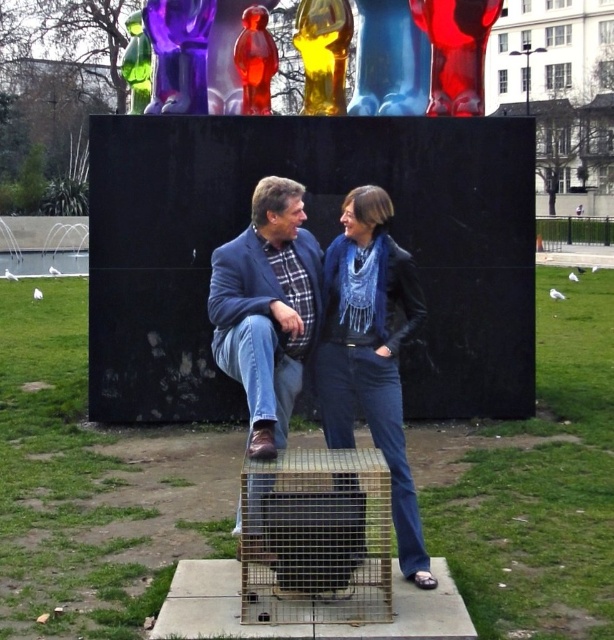
You are a photographer trying to capture a clear photo of the blue denim scarf at center without the matte blue jacket at center blocking it. Based on their positions in the scene, is this possible?

The matte blue jacket at center is behind the blue denim scarf at center, so it is possible to capture a clear photo of the blue denim scarf at center without the matte blue jacket at center blocking it by adjusting the angle to ensure the jacket remains behind the scarf.

You are standing in front of the sculpture and want to determine which of the two points, point (352,358) or point (297,193), is closer to you. Based on the scene description, which point is nearer?

Point (352,358) is further to the viewer than point (297,193), so the closer point to you is point (297,193).

What are the coordinates of the blue denim scarf at center?

The coordinates of the blue denim scarf at center are at point (370, 353).